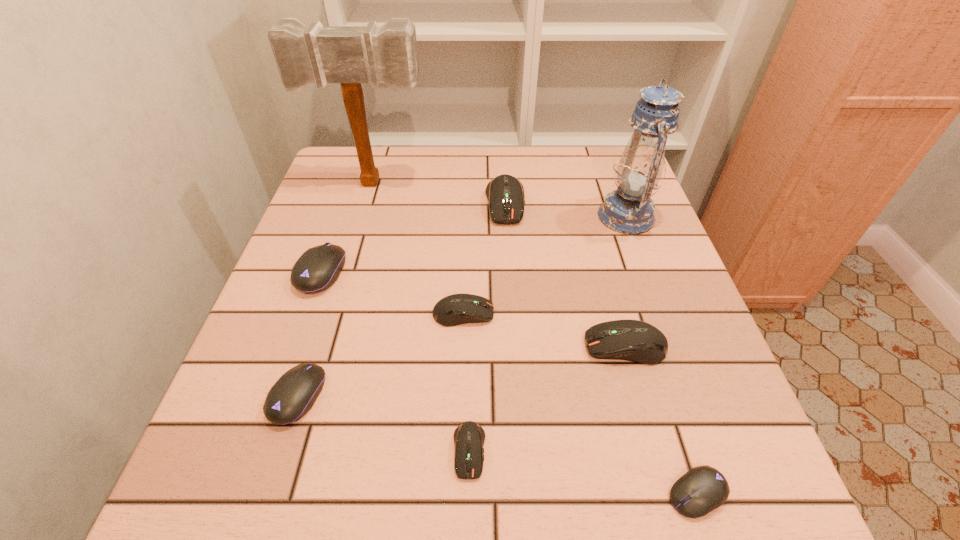
Point out which computer mouse is positioned as the second nearest to the tallest computer mouse. Please provide its 2D coordinates. Your answer should be formatted as a tuple, i.e. [(x, y)], where the tuple contains the x and y coordinates of a point satisfying the conditions above.

[(631, 340)]

Select which dark computer equipment appears as the third closest to the second smallest black computer mouse. Please provide its 2D coordinates. Your answer should be formatted as a tuple, i.e. [(x, y)], where the tuple contains the x and y coordinates of a point satisfying the conditions above.

[(631, 340)]

Locate which dark computer equipment is the closest to the mallet. Please provide its 2D coordinates. Your answer should be formatted as a tuple, i.e. [(x, y)], where the tuple contains the x and y coordinates of a point satisfying the conditions above.

[(505, 193)]

Locate an element on the screen. This screenshot has height=540, width=960. the closest black computer mouse to the second biggest black computer mouse is located at coordinates (318, 268).

Identify which black computer mouse is located as the second nearest to the smallest black computer mouse. Please provide its 2D coordinates. Your answer should be formatted as a tuple, i.e. [(x, y)], where the tuple contains the x and y coordinates of a point satisfying the conditions above.

[(318, 268)]

Find the location of a particular element. Image resolution: width=960 pixels, height=540 pixels. free spot that satisfies the following two spatial constraints: 1. on the button of the tallest computer mouse; 2. on the button of the second farthest dark computer equipment is located at coordinates (513, 314).

Where is `free region that satisfies the following two spatial constraints: 1. on the button of the third smallest dark computer equipment; 2. on the right side of the smallest black computer mouse`? free region that satisfies the following two spatial constraints: 1. on the button of the third smallest dark computer equipment; 2. on the right side of the smallest black computer mouse is located at coordinates coord(666,494).

Identify the location of free space that satisfies the following two spatial constraints: 1. on the back side of the nearest black computer mouse; 2. on the button of the second biggest dark computer equipment. This screenshot has width=960, height=540. (649, 346).